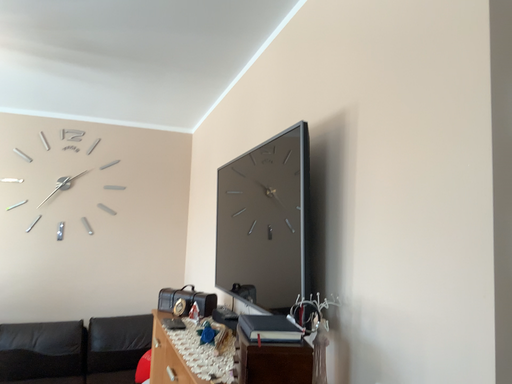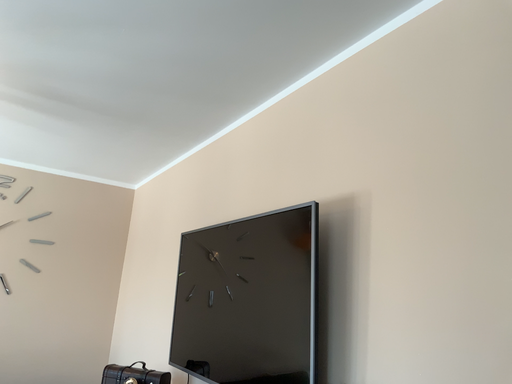
Question: How did the camera likely rotate when shooting the video?

Choices:
 (A) rotated downward
 (B) rotated upward

Answer: (B)